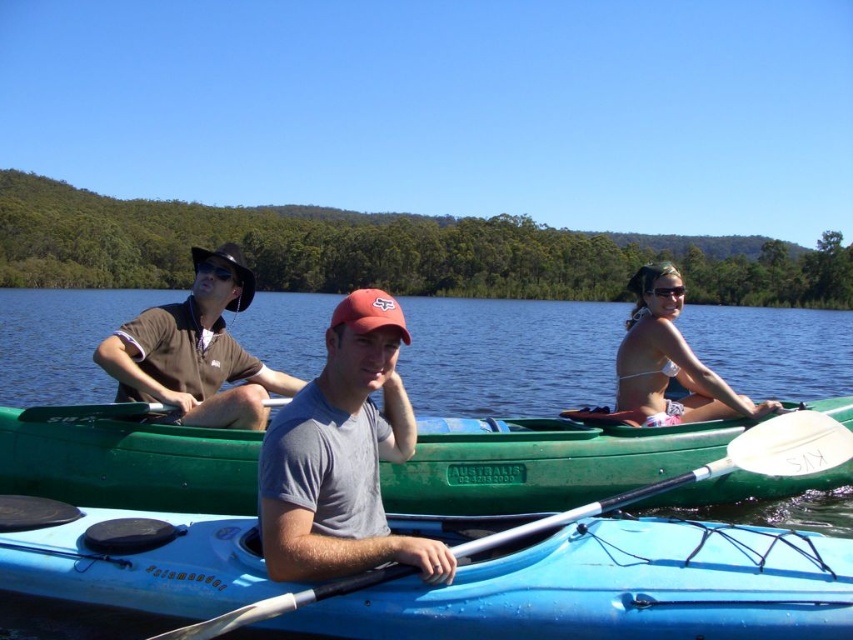
Is brown cotton shirt at upper left further to camera compared to white plastic paddle at center?

Yes, it is.

What do you see at coordinates (196, 352) in the screenshot? I see `brown cotton shirt at upper left` at bounding box center [196, 352].

At what (x,y) coordinates should I click in order to perform the action: click on brown cotton shirt at upper left. Please return your answer as a coordinate pair (x, y). This screenshot has width=853, height=640. Looking at the image, I should click on (196, 352).

Who is positioned more to the left, green plastic kayak at center or gray matte t-shirt at center?

Positioned to the left is green plastic kayak at center.

Which is above, green plastic kayak at center or gray matte t-shirt at center?

gray matte t-shirt at center

Is point (15, 451) in front of point (368, 561)?

No, (15, 451) is further to viewer.

The width and height of the screenshot is (853, 640). Find the location of `green plastic kayak at center`. green plastic kayak at center is located at coordinates (538, 461).

Is blue water at center below transparent plastic goggles at upper center?

Actually, blue water at center is above transparent plastic goggles at upper center.

Is blue water at center shorter than transparent plastic goggles at upper center?

In fact, blue water at center may be taller than transparent plastic goggles at upper center.

What do you see at coordinates (509, 355) in the screenshot? This screenshot has width=853, height=640. I see `blue water at center` at bounding box center [509, 355].

Image resolution: width=853 pixels, height=640 pixels. I want to click on blue water at center, so click(509, 355).